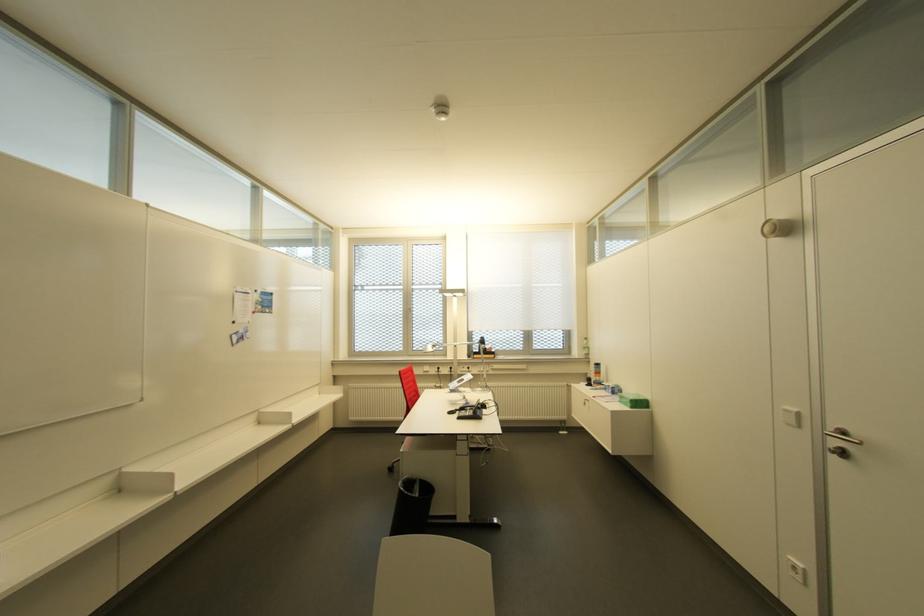
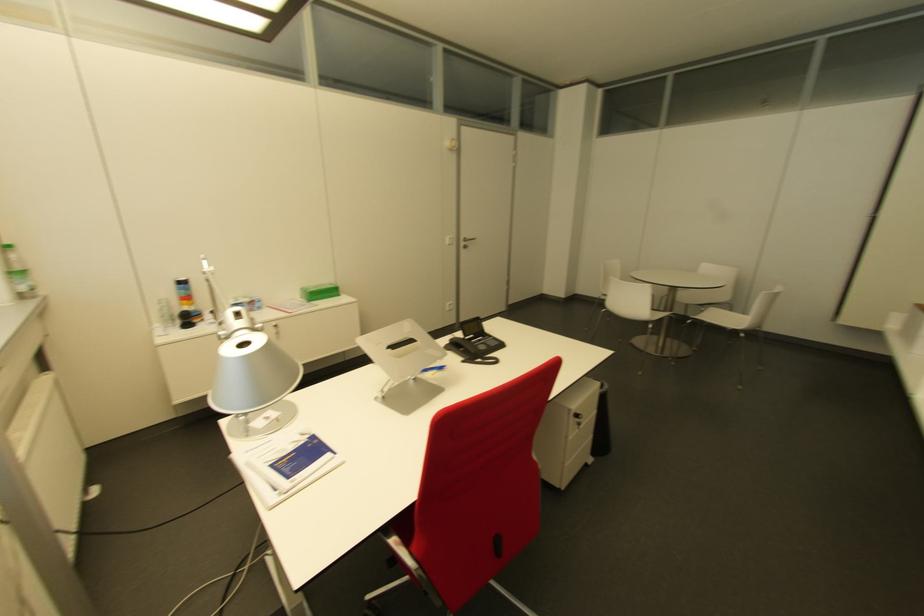
The point at (842,455) is marked in the first image. Where is the corresponding point in the second image?

(463, 246)